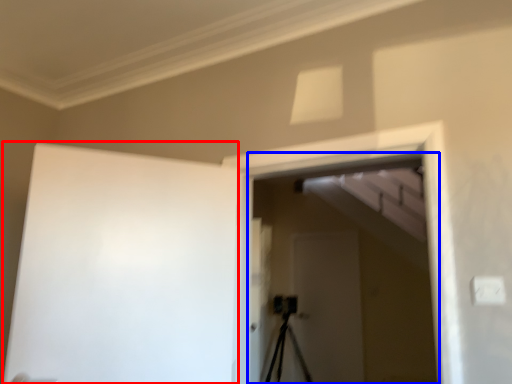
Question: Which point is further to the camera, barn door (highlighted by a red box) or screen door (highlighted by a blue box)?

Choices:
 (A) barn door
 (B) screen door

Answer: (B)